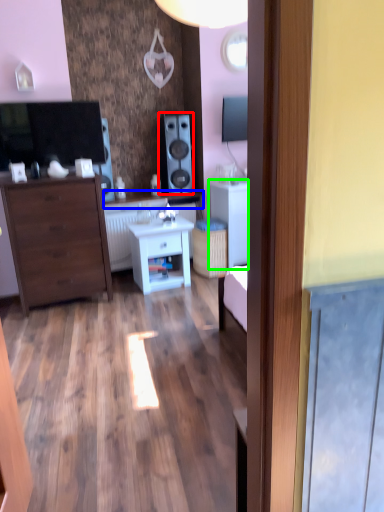
Question: Considering the real-world distances, which object is farthest from speaker (highlighted by a red box)? counter top (highlighted by a blue box) or cabinetry (highlighted by a green box)?

Choices:
 (A) counter top
 (B) cabinetry

Answer: (B)